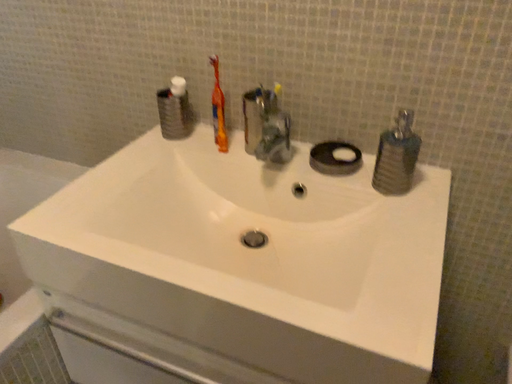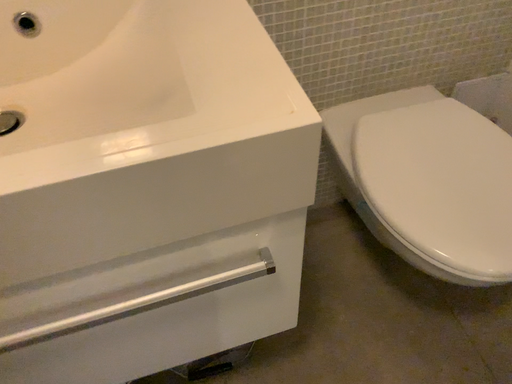
Question: Which way did the camera rotate in the video?

Choices:
 (A) rotated downward
 (B) rotated upward

Answer: (A)